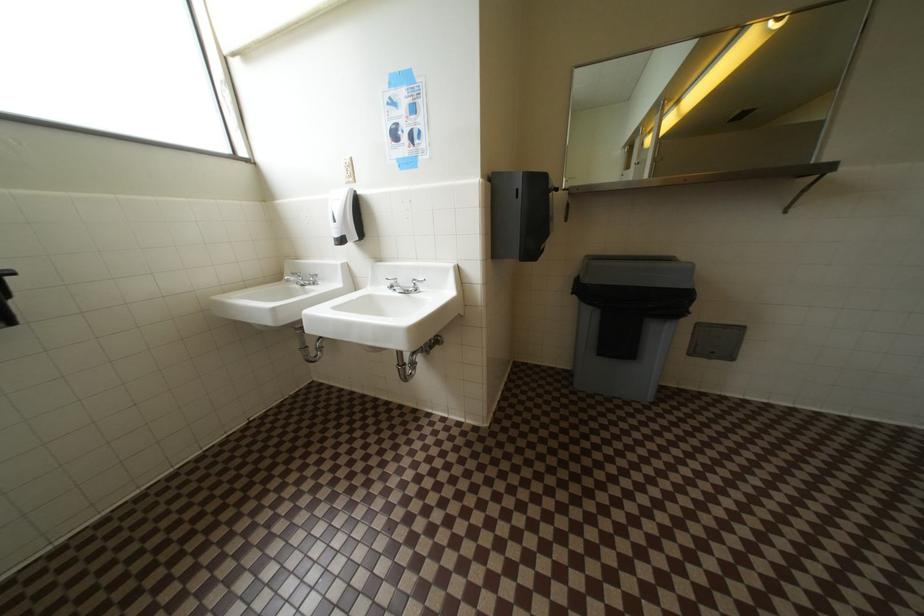
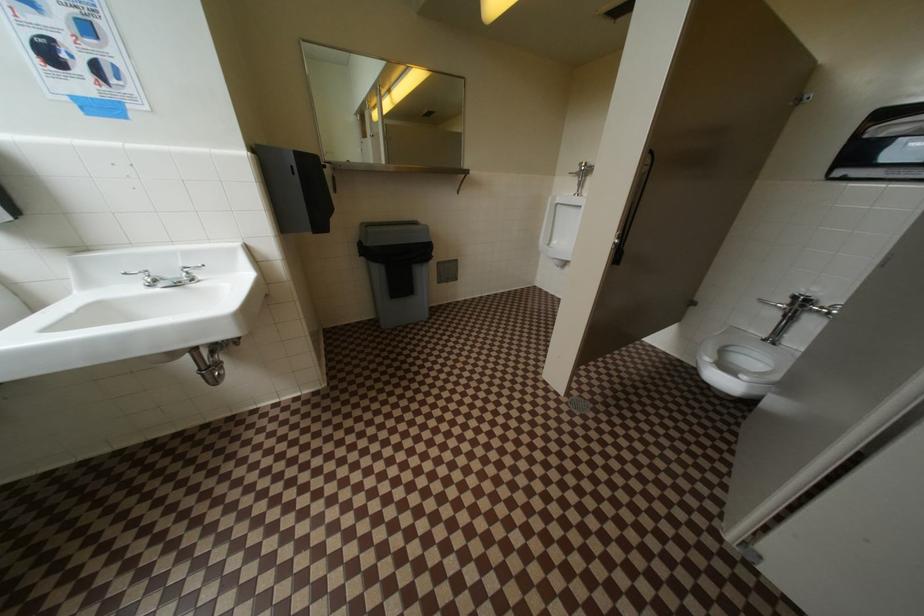
Question: The first image is from the beginning of the video and the second image is from the end. How did the camera likely rotate when shooting the video?

Choices:
 (A) Left
 (B) Right
 (C) Up
 (D) Down

Answer: (B)